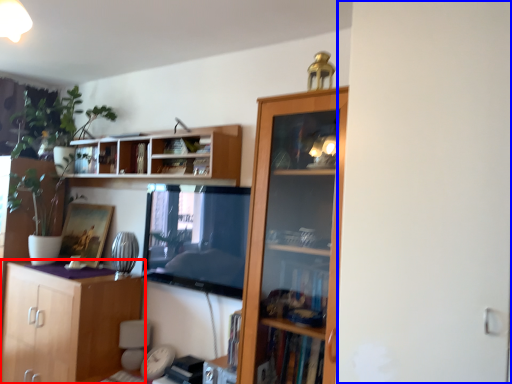
Question: Which point is closer to the camera, cabinetry (highlighted by a red box) or screen door (highlighted by a blue box)?

Choices:
 (A) cabinetry
 (B) screen door

Answer: (B)